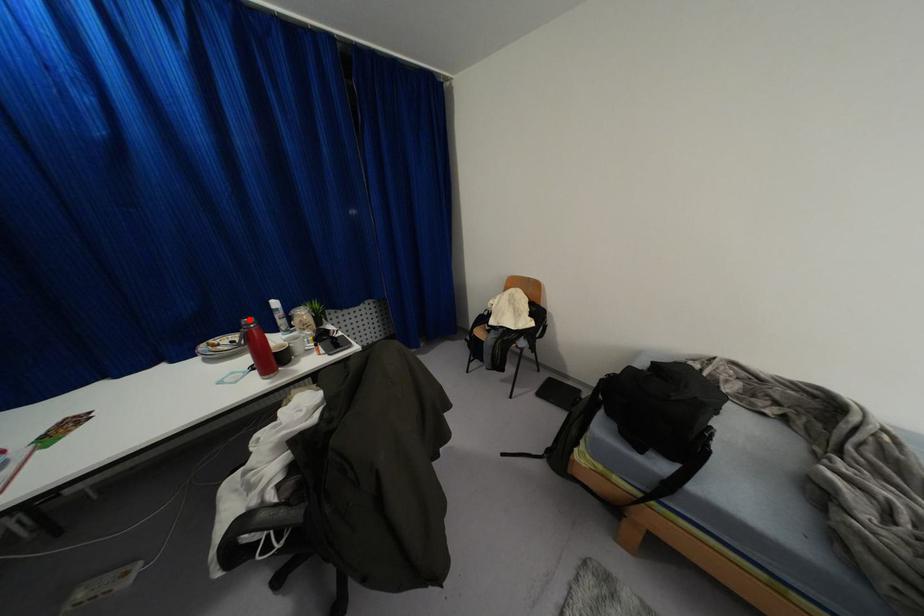
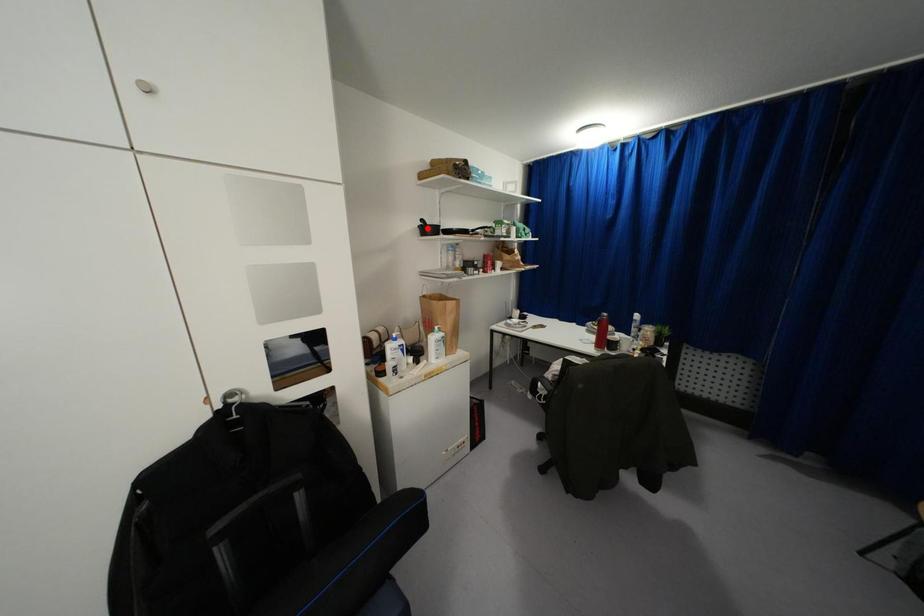
I am providing you with two images of the same scene from different viewpoints. A red point is marked on the first image and another point is marked on the second image. Do the highlighted points in image1 and image2 indicate the same real-world spot?

No